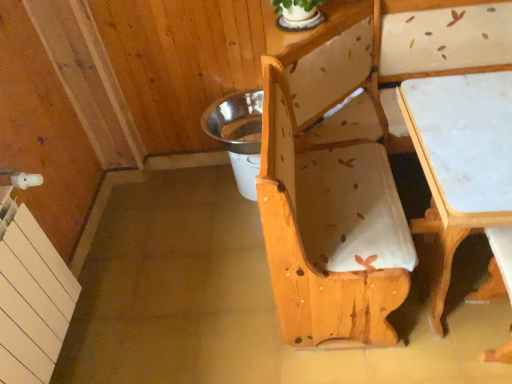
Where is `free space between white marble table at lower right and natural wood bench at center`? The height and width of the screenshot is (384, 512). free space between white marble table at lower right and natural wood bench at center is located at coordinates (362, 357).